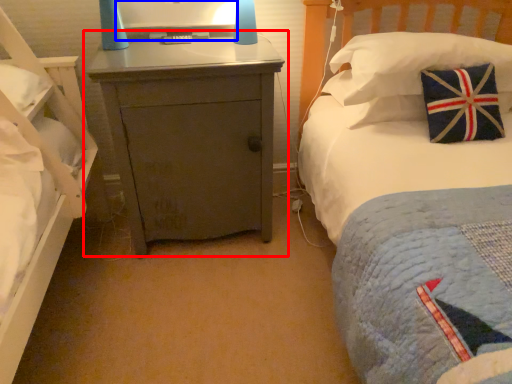
Question: Among these objects, which one is nearest to the camera, nightstand (highlighted by a red box) or computer monitor (highlighted by a blue box)?

Choices:
 (A) nightstand
 (B) computer monitor

Answer: (A)